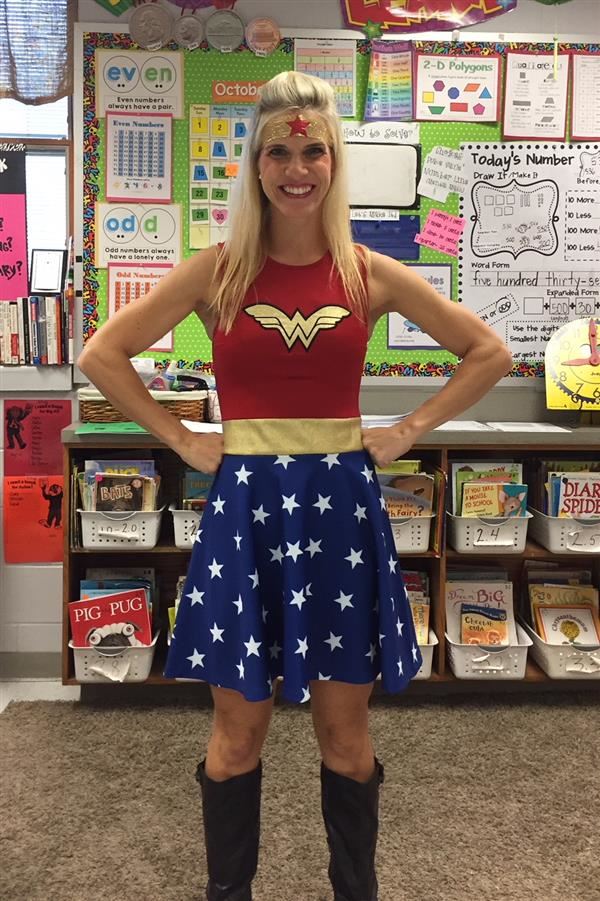
I want to click on bins, so click(125, 528), click(128, 649), click(488, 652), click(566, 656), click(566, 551), click(487, 539), click(405, 537), click(423, 649), click(185, 523).